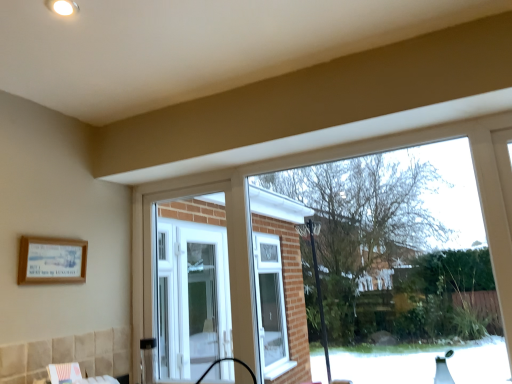
Image resolution: width=512 pixels, height=384 pixels. What do you see at coordinates (271, 306) in the screenshot?
I see `white plastic window at center` at bounding box center [271, 306].

Locate an element on the screen. The image size is (512, 384). white plastic window at center is located at coordinates (271, 306).

In order to face white plastic window at center, should I rotate leftwards or rightwards?

Turn right approximately 1.694 degrees to face it.

In the scene shown: What is the approximate width of white plastic window at center?

It is 9.63 centimeters.

This screenshot has height=384, width=512. What do you see at coordinates (51, 260) in the screenshot?
I see `wooden framed poster at lower left` at bounding box center [51, 260].

The width and height of the screenshot is (512, 384). I want to click on wooden framed poster at lower left, so click(x=51, y=260).

Locate an element on the screen. white plastic window at center is located at coordinates (271, 306).

In the scene shown: Between wooden framed poster at lower left and white plastic window at center, which one appears on the right side from the viewer's perspective?

white plastic window at center.

Relative to white plastic window at center, is wooden framed poster at lower left in front or behind?

wooden framed poster at lower left is positioned closer to the viewer than white plastic window at center.

Between point (41, 249) and point (274, 364), which one is positioned behind?

Positioned behind is point (274, 364).

From the image's perspective, which is above, wooden framed poster at lower left or white plastic window at center?

wooden framed poster at lower left appears higher in the image.

From a real-world perspective, does wooden framed poster at lower left sit lower than white plastic window at center?

Incorrect, from a real-world perspective, wooden framed poster at lower left is higher than white plastic window at center.

Does wooden framed poster at lower left have a greater width compared to white plastic window at center?

In fact, wooden framed poster at lower left might be narrower than white plastic window at center.

From the picture: Who is shorter, wooden framed poster at lower left or white plastic window at center?

wooden framed poster at lower left.

Considering the relative sizes of wooden framed poster at lower left and white plastic window at center in the image provided, is wooden framed poster at lower left bigger than white plastic window at center?

Incorrect, wooden framed poster at lower left is not larger than white plastic window at center.

Do you think wooden framed poster at lower left is within white plastic window at center, or outside of it?

wooden framed poster at lower left is not inside white plastic window at center, it's outside.

Are wooden framed poster at lower left and white plastic window at center located far from each other?

Yes, wooden framed poster at lower left is far from white plastic window at center.

Is white plastic window at center at the back of wooden framed poster at lower left?

No.

Where is `window beneath the wooden framed poster at lower left (from a real-world perspective)`? This screenshot has height=384, width=512. window beneath the wooden framed poster at lower left (from a real-world perspective) is located at coordinates (271, 306).

Is white plastic window at center at the left side of wooden framed poster at lower left?

In fact, white plastic window at center is to the right of wooden framed poster at lower left.

Is white plastic window at center in front of or behind wooden framed poster at lower left in the image?

Clearly, white plastic window at center is behind wooden framed poster at lower left.

Is point (281, 320) closer to camera compared to point (63, 240)?

No.

From the image's perspective, is white plastic window at center over wooden framed poster at lower left?

Incorrect, from the image's perspective, white plastic window at center is lower than wooden framed poster at lower left.

From a real-world perspective, which is physically below, white plastic window at center or wooden framed poster at lower left?

In real-world perspective, white plastic window at center is lower.

Considering the sizes of white plastic window at center and wooden framed poster at lower left in the image, is white plastic window at center wider or thinner than wooden framed poster at lower left?

Clearly, white plastic window at center has more width compared to wooden framed poster at lower left.

Considering the sizes of objects white plastic window at center and wooden framed poster at lower left in the image provided, who is shorter, white plastic window at center or wooden framed poster at lower left?

Standing shorter between the two is wooden framed poster at lower left.

Who is smaller, white plastic window at center or wooden framed poster at lower left?

wooden framed poster at lower left is smaller.

Would you say white plastic window at center is inside or outside wooden framed poster at lower left?

white plastic window at center is not enclosed by wooden framed poster at lower left.

Looking at this image, is white plastic window at center in contact with wooden framed poster at lower left?

No, white plastic window at center is not with wooden framed poster at lower left.

Could you tell me if white plastic window at center is turned towards wooden framed poster at lower left?

No, white plastic window at center is not aimed at wooden framed poster at lower left.

Can you tell me how much white plastic window at center and wooden framed poster at lower left differ in facing direction?

The facing directions of white plastic window at center and wooden framed poster at lower left are 180 degrees apart.

How far apart are white plastic window at center and wooden framed poster at lower left?

The distance of white plastic window at center from wooden framed poster at lower left is 10.57 feet.

At what (x,y) coordinates should I click in order to perform the action: click on window behind the wooden framed poster at lower left. Please return your answer as a coordinate pair (x, y). The width and height of the screenshot is (512, 384). Looking at the image, I should click on (271, 306).

Locate an element on the screen. The width and height of the screenshot is (512, 384). window below the wooden framed poster at lower left (from the image's perspective) is located at coordinates (271, 306).

The width and height of the screenshot is (512, 384). I want to click on picture frame above the white plastic window at center (from a real-world perspective), so click(x=51, y=260).